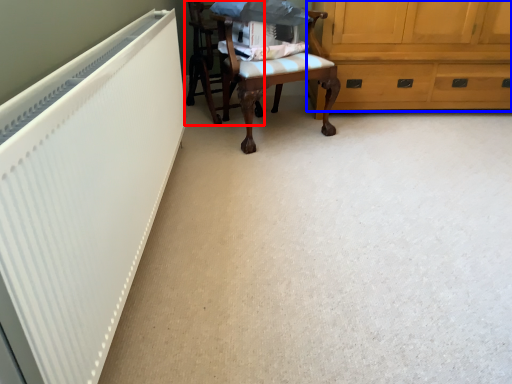
Question: Which of the following is the closest to the observer, chair (highlighted by a red box) or cabinetry (highlighted by a blue box)?

Choices:
 (A) chair
 (B) cabinetry

Answer: (A)